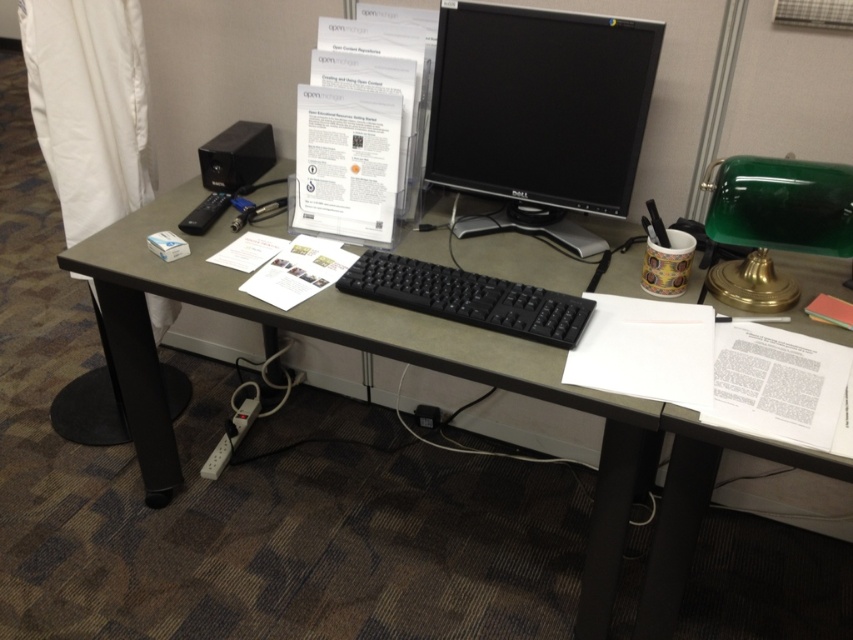
Question: Does black plastic computer desk at center appear under black glossy monitor at center?

Choices:
 (A) yes
 (B) no

Answer: (A)

Question: Is black plastic computer desk at center closer to camera compared to black matte keyboard at center?

Choices:
 (A) no
 (B) yes

Answer: (B)

Question: Does black glossy monitor at center lie behind black matte keyboard at center?

Choices:
 (A) yes
 (B) no

Answer: (A)

Question: Which of the following is the farthest from the observer?

Choices:
 (A) black plastic computer desk at center
 (B) black matte keyboard at center
 (C) black glossy monitor at center

Answer: (C)

Question: Estimate the real-world distances between objects in this image. Which object is farther from the black glossy monitor at center?

Choices:
 (A) black matte keyboard at center
 (B) black plastic computer desk at center

Answer: (A)

Question: Among these points, which one is farthest from the camera?

Choices:
 (A) (460, 301)
 (B) (601, 548)
 (C) (492, 104)

Answer: (C)